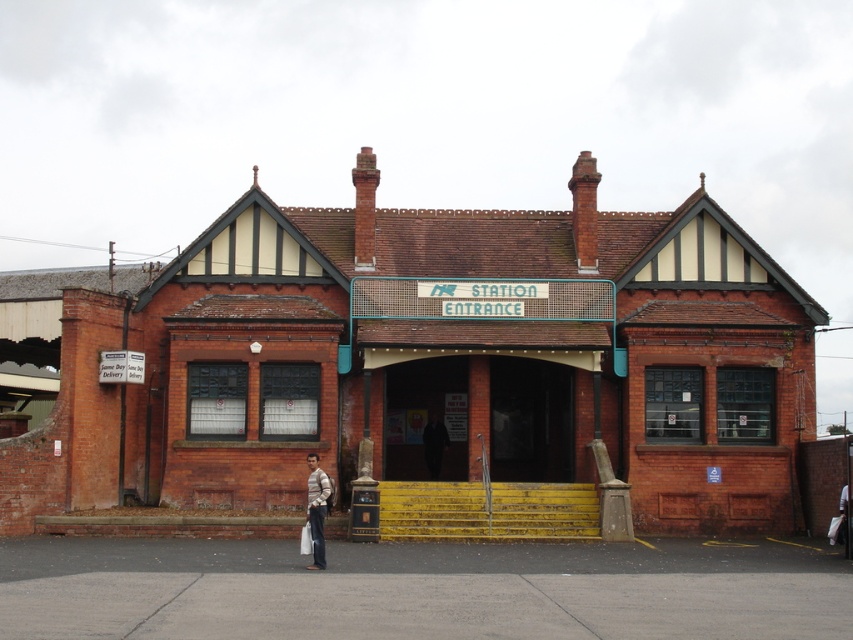
Question: Estimate the real-world distances between objects in this image. Which object is closer to the dark brown leather jacket at center?

Choices:
 (A) brick building at center
 (B) striped sweater at lower left

Answer: (A)

Question: Which of the following is the farthest from the observer?

Choices:
 (A) (399, 369)
 (B) (432, 420)

Answer: (A)

Question: Is brick building at center bigger than dark brown leather jacket at center?

Choices:
 (A) yes
 (B) no

Answer: (A)

Question: Which point is farther to the camera?

Choices:
 (A) brick building at center
 (B) striped sweater at lower left
 (C) dark brown leather jacket at center

Answer: (C)

Question: Can you confirm if brick building at center is smaller than striped sweater at lower left?

Choices:
 (A) yes
 (B) no

Answer: (B)

Question: Is brick building at center above striped sweater at lower left?

Choices:
 (A) no
 (B) yes

Answer: (B)